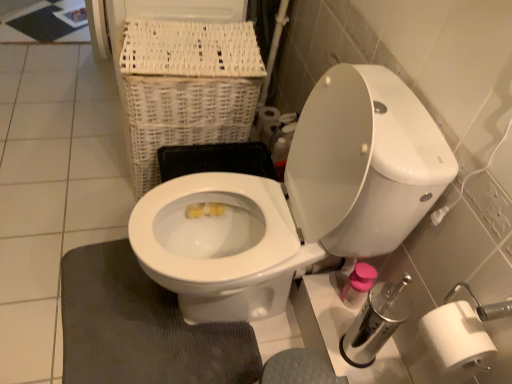
Question: From the image's perspective, is white glossy toilet at center under dark gray textured bath mat at lower left?

Choices:
 (A) yes
 (B) no

Answer: (B)

Question: From the image's perspective, does white glossy toilet at center appear higher than dark gray textured bath mat at lower left?

Choices:
 (A) no
 (B) yes

Answer: (B)

Question: Is dark gray textured bath mat at lower left inside white glossy toilet at center?

Choices:
 (A) no
 (B) yes

Answer: (B)

Question: Is white glossy toilet at center looking in the opposite direction of dark gray textured bath mat at lower left?

Choices:
 (A) no
 (B) yes

Answer: (A)

Question: Is white glossy toilet at center not near dark gray textured bath mat at lower left?

Choices:
 (A) yes
 (B) no

Answer: (B)

Question: Can you confirm if white glossy toilet at center is shorter than dark gray textured bath mat at lower left?

Choices:
 (A) yes
 (B) no

Answer: (B)

Question: Is white wicker basket at upper left inside dark gray textured bath mat at lower left?

Choices:
 (A) no
 (B) yes

Answer: (A)

Question: Is dark gray textured bath mat at lower left bigger than white wicker basket at upper left?

Choices:
 (A) yes
 (B) no

Answer: (B)

Question: From the image's perspective, is dark gray textured bath mat at lower left located above white wicker basket at upper left?

Choices:
 (A) no
 (B) yes

Answer: (A)

Question: Is dark gray textured bath mat at lower left positioned before white wicker basket at upper left?

Choices:
 (A) yes
 (B) no

Answer: (A)

Question: Is dark gray textured bath mat at lower left placed right next to white wicker basket at upper left?

Choices:
 (A) yes
 (B) no

Answer: (B)

Question: Is dark gray textured bath mat at lower left completely or partially outside of white wicker basket at upper left?

Choices:
 (A) no
 (B) yes

Answer: (B)

Question: Does white glossy toilet at center lie behind white matte toilet paper at right?

Choices:
 (A) yes
 (B) no

Answer: (B)